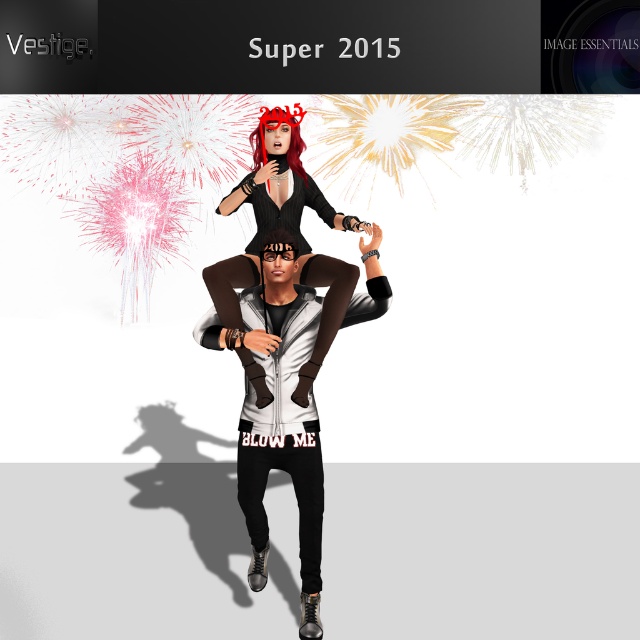
Who is higher up, white matte jacket at center or matte black dress at center?

matte black dress at center is higher up.

Can you confirm if white matte jacket at center is thinner than matte black dress at center?

No.

Who is more forward, (307, 632) or (278, 225)?

Point (307, 632) is in front.

Locate an element on the screen. The width and height of the screenshot is (640, 640). white matte jacket at center is located at coordinates (278, 412).